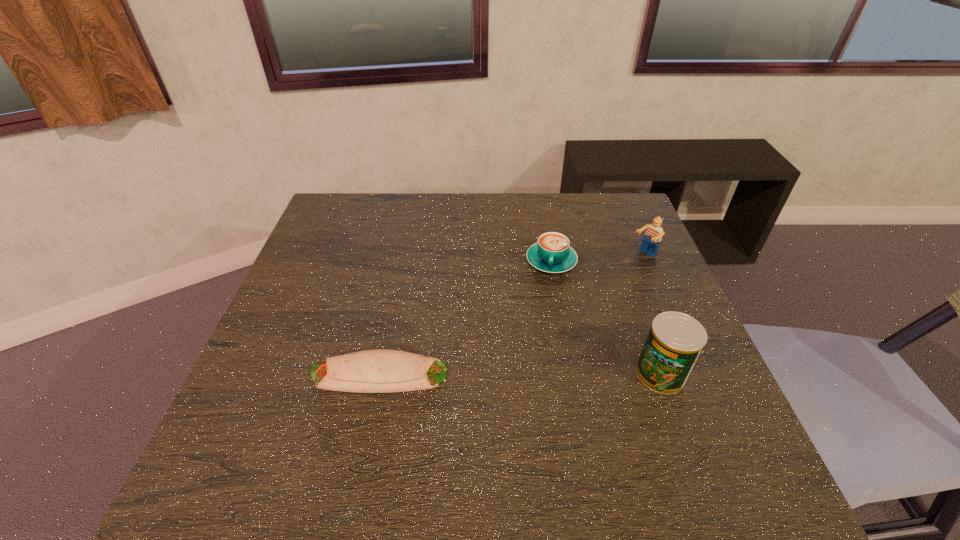
You are a GUI agent. You are given a task and a screenshot of the screen. Output one action in this format:
    pyautogui.click(x=<x>, y=<y>)
    Task: Click on the vacant space located 0.390m with the handle on the right side of the second object from left to right
    
    Given the screenshot: What is the action you would take?
    pyautogui.click(x=529, y=402)

Find the location of `free space located 0.070m on the face of the third shortest object`. free space located 0.070m on the face of the third shortest object is located at coordinates (621, 272).

In order to click on vacant region located on the face of the third shortest object in this screenshot , I will do `click(602, 288)`.

In order to click on vacant space located on the face of the third shortest object in this screenshot , I will do `click(572, 310)`.

Find the location of `object located at the left edge`. object located at the left edge is located at coordinates (380, 370).

The image size is (960, 540). Find the location of `can situated at the right edge`. can situated at the right edge is located at coordinates (675, 341).

The height and width of the screenshot is (540, 960). Find the location of `Lego positioned at the right edge`. Lego positioned at the right edge is located at coordinates (652, 238).

The height and width of the screenshot is (540, 960). In order to click on vacant space at the far edge in this screenshot , I will do `click(444, 226)`.

This screenshot has height=540, width=960. In order to click on vacant area at the near edge of the desktop in this screenshot , I will do `click(474, 433)`.

Locate an element on the screen. The width and height of the screenshot is (960, 540). free space at the left edge is located at coordinates 317,300.